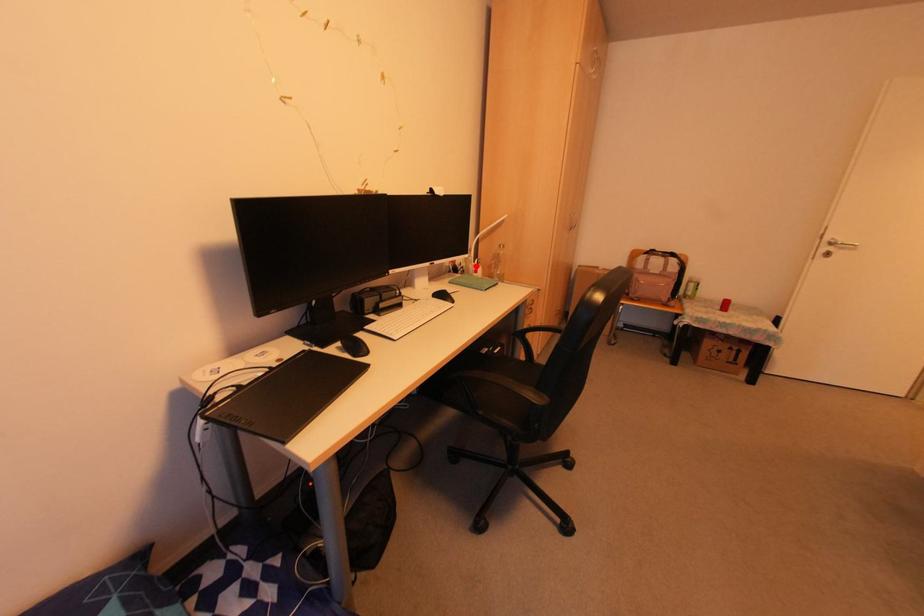
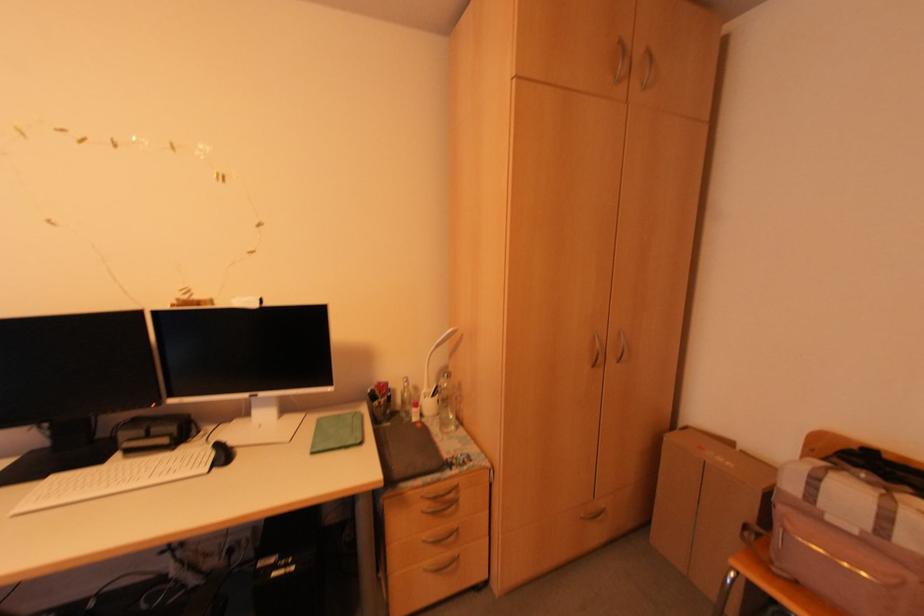
Where in the second image is the point corresponding to the highlighted location from the first image?

(431, 395)